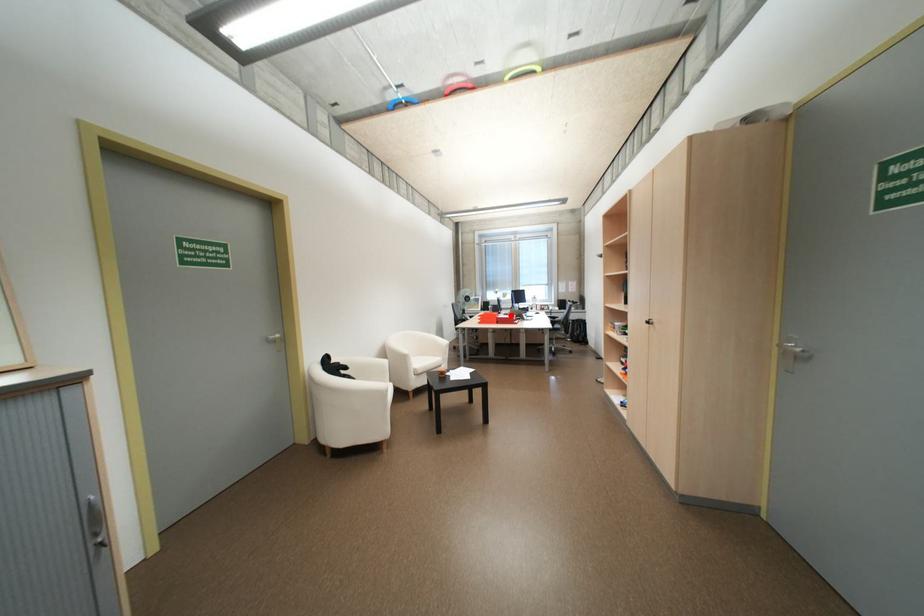
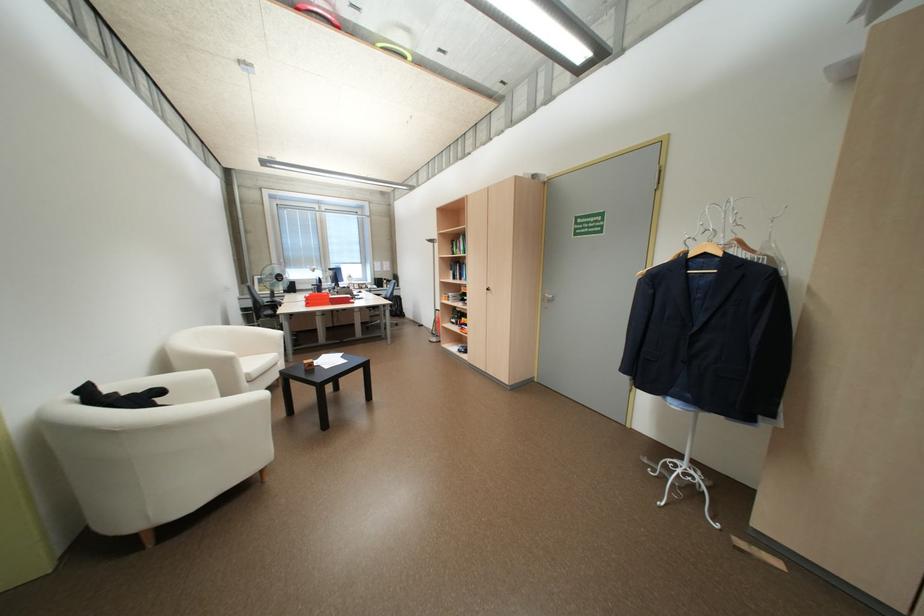
In the second image, find the point that corresponds to the highlighted location in the first image.

(342, 296)